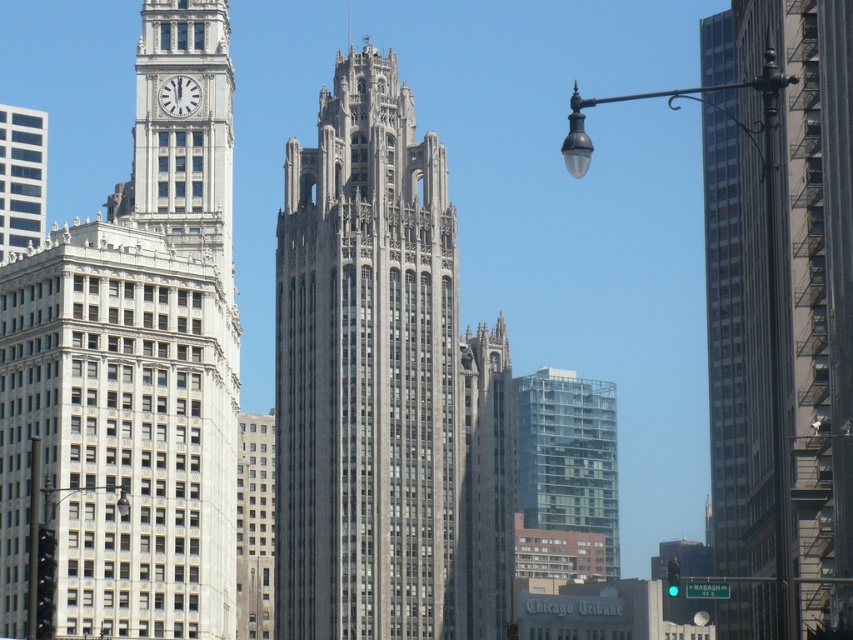
Consider the image. You are a city planner assessing the skyline. Given the gray stone tower at center and the clear glass building at center, which one has a greater width when viewed from the street level?

The gray stone tower at center has a greater width than the clear glass building at center when viewed from the street level.

Based on the scene description, what is located at the coordinates point (131, 371)?

The white stone clock tower at left is located at point (131, 371).